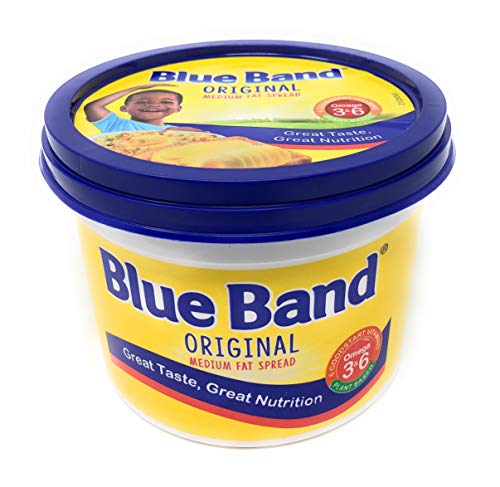
Find the location of `container bowl`. container bowl is located at coordinates (394, 302).